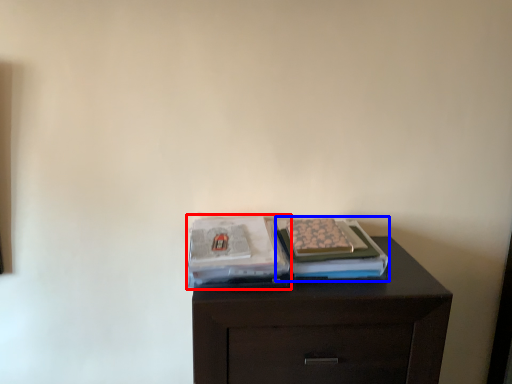
Question: Which point is closer to the camera, magazine (highlighted by a red box) or magazine (highlighted by a blue box)?

Choices:
 (A) magazine
 (B) magazine

Answer: (A)